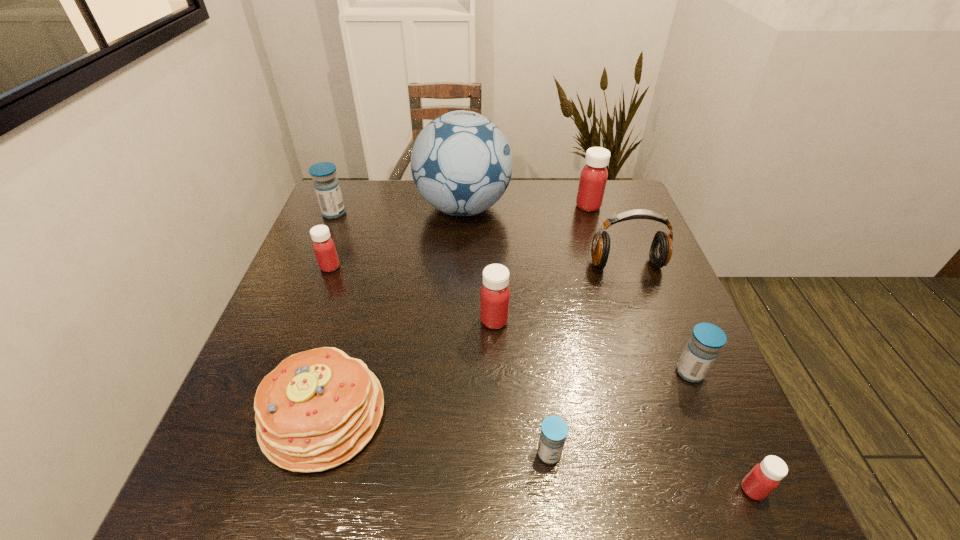
Image resolution: width=960 pixels, height=540 pixels. Identify the location of vacant region located on the ear cups of the headset. (639, 300).

I want to click on vacant region located 0.080m on the front of the farthest blue medicine, so click(x=324, y=237).

Find the location of a particular element. vacant point located on the front of the fourth nearest medicine is located at coordinates (499, 470).

This screenshot has width=960, height=540. Find the location of `free space located on the back of the leftmost red medicine`. free space located on the back of the leftmost red medicine is located at coordinates click(352, 207).

Identify the location of free point located on the left of the second farthest blue medicine. (559, 372).

This screenshot has width=960, height=540. Identify the location of blank space located on the right of the pancake. (426, 415).

Where is `free spot located on the left of the second blue medicine from right to left`? This screenshot has width=960, height=540. free spot located on the left of the second blue medicine from right to left is located at coordinates (503, 454).

Find the location of a particular element. free space located on the back of the smallest red medicine is located at coordinates (681, 326).

The height and width of the screenshot is (540, 960). I want to click on soccer ball located at the far edge, so click(x=461, y=162).

Locate an element on the screen. This screenshot has height=540, width=960. pancake at the near edge is located at coordinates (317, 409).